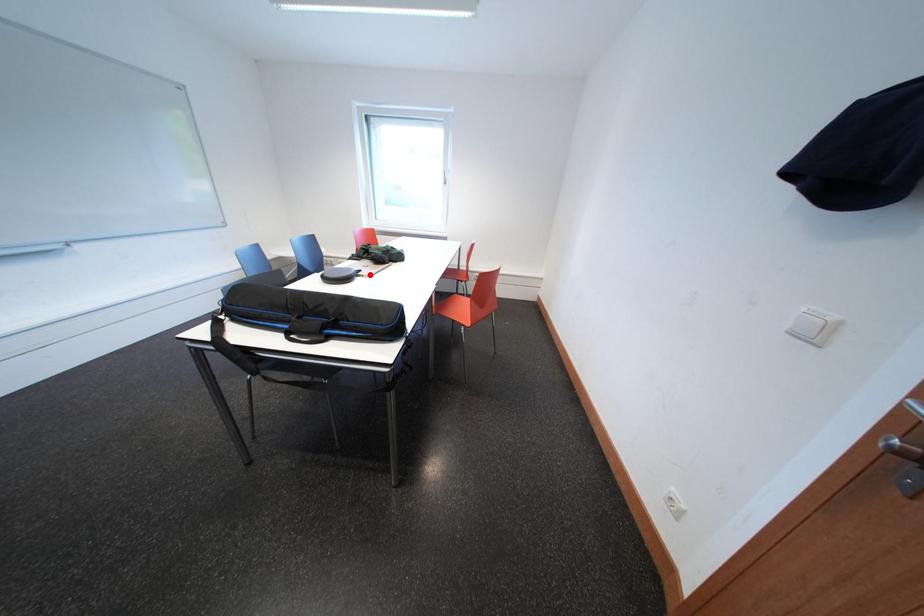
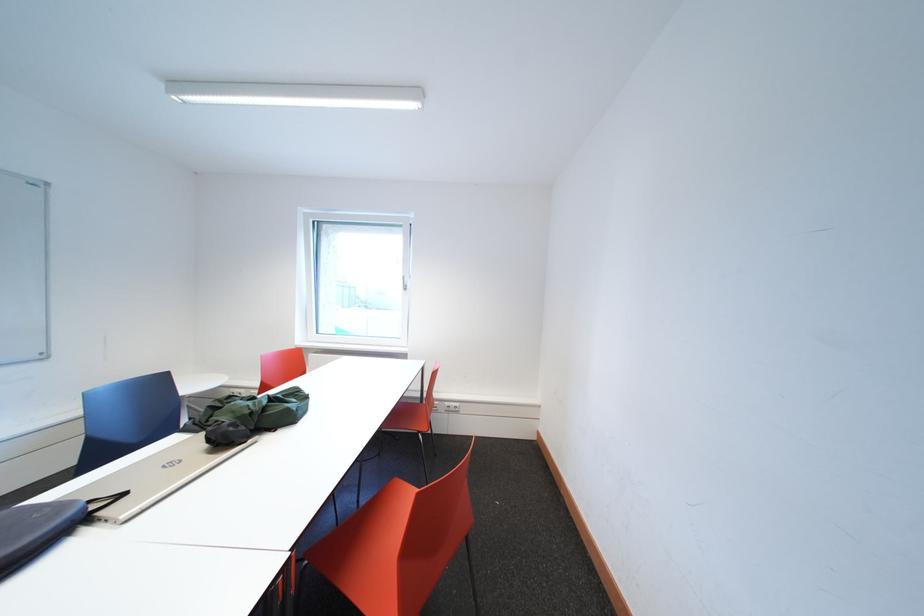
In the second image, find the point that corresponds to the highlighted location in the first image.

(134, 499)